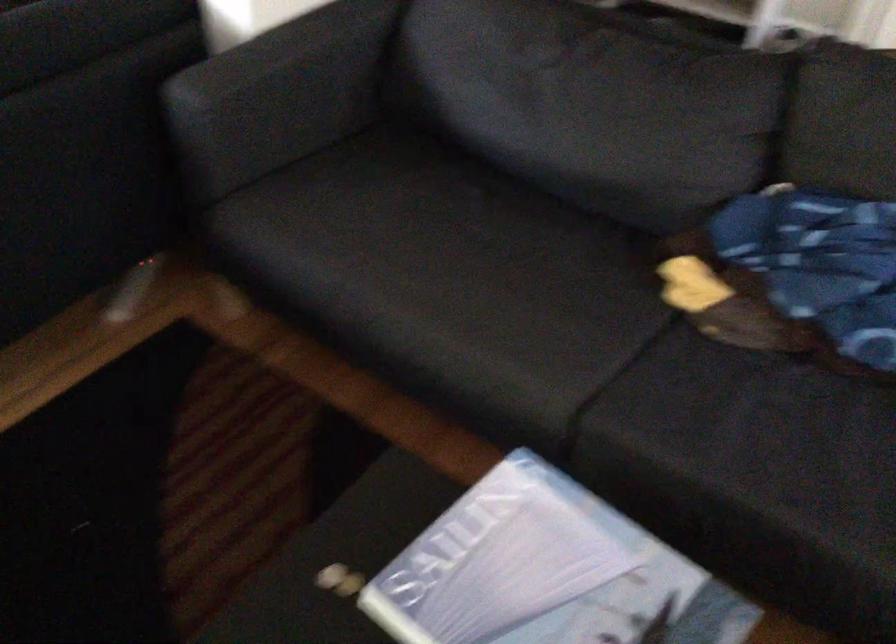
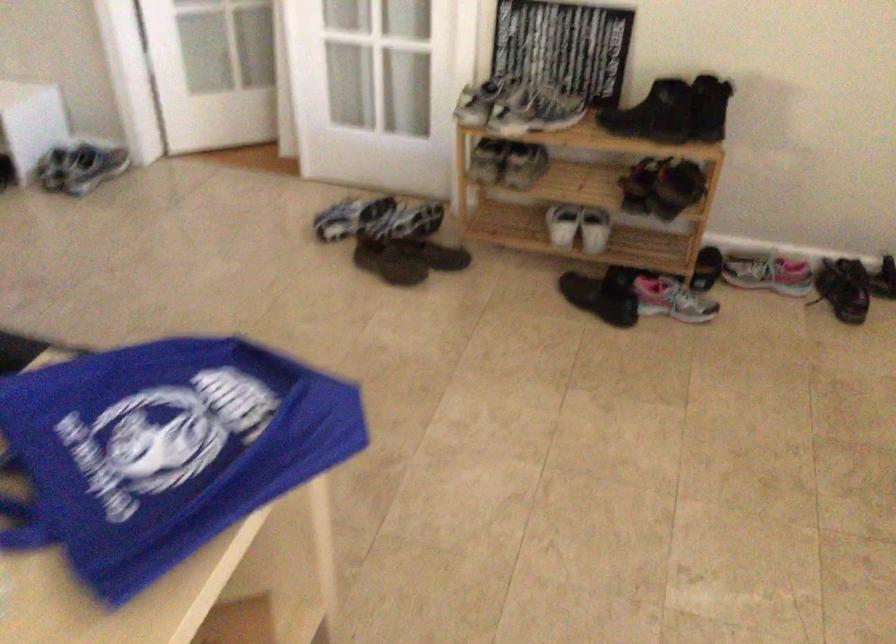
Question: The images are taken continuously from a first-person perspective. In which direction are you moving?

Choices:
 (A) Left
 (B) Right
 (C) Forward
 (D) Backward

Answer: (B)